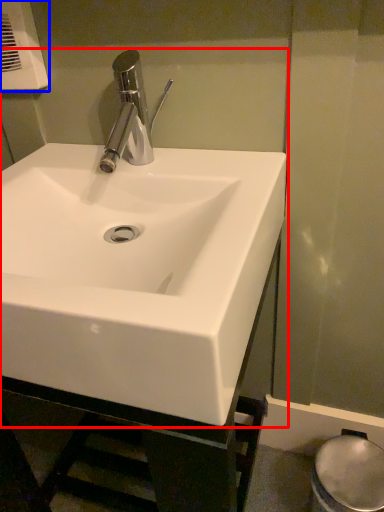
Question: Which point is further to the camera, sink (highlighted by a red box) or hand dryer (highlighted by a blue box)?

Choices:
 (A) sink
 (B) hand dryer

Answer: (B)